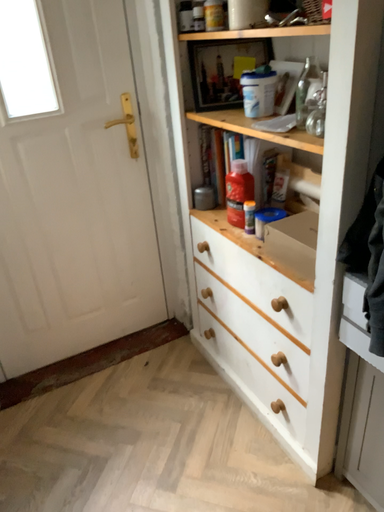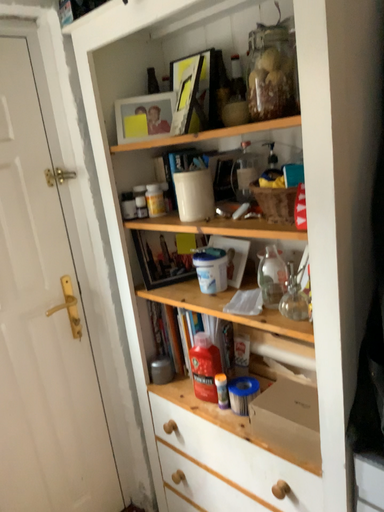
Question: Which way did the camera rotate in the video?

Choices:
 (A) rotated downward
 (B) rotated upward

Answer: (B)